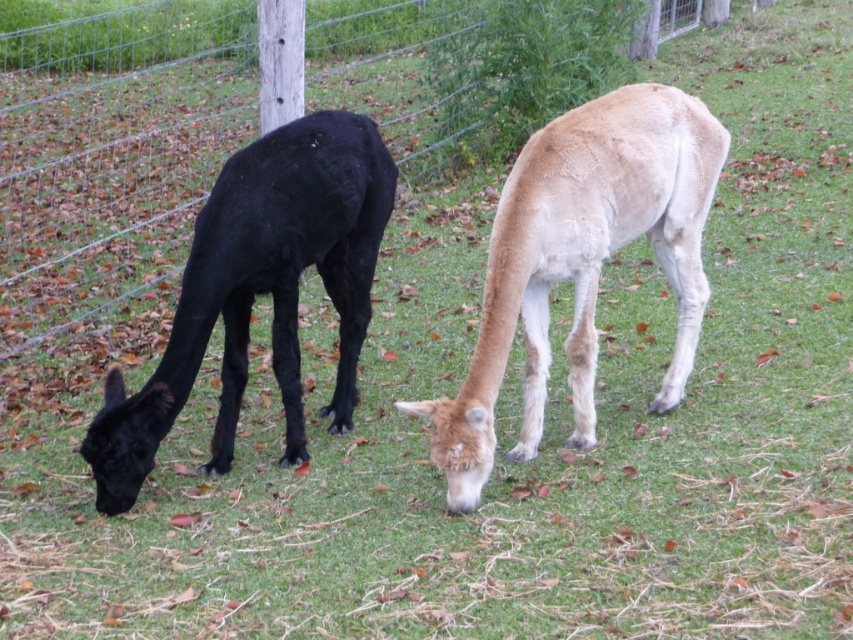
Question: Which object is farther from the camera taking this photo?

Choices:
 (A) light brown woolen alpaca at center
 (B) shiny black llama at left

Answer: (B)

Question: Does light brown woolen alpaca at center appear on the left side of shiny black llama at left?

Choices:
 (A) no
 (B) yes

Answer: (A)

Question: Does light brown woolen alpaca at center have a smaller size compared to shiny black llama at left?

Choices:
 (A) no
 (B) yes

Answer: (A)

Question: Does light brown woolen alpaca at center appear on the left side of shiny black llama at left?

Choices:
 (A) no
 (B) yes

Answer: (A)